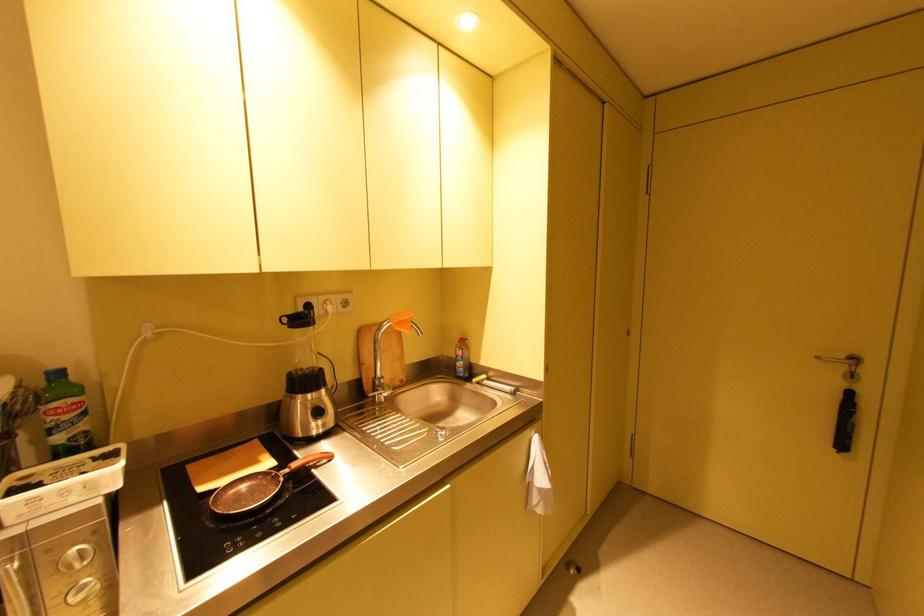
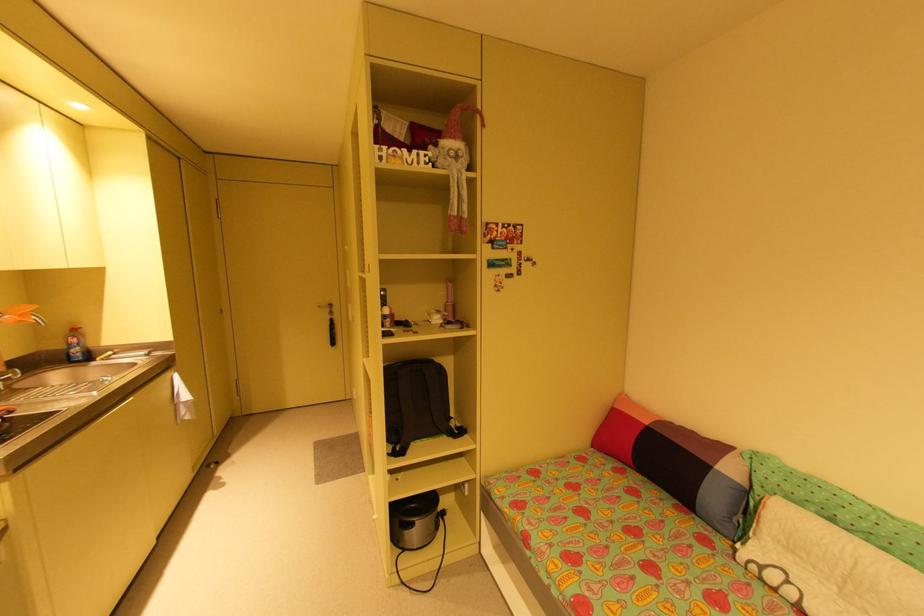
Find the pixel in the second image that matches [848,369] in the first image.

(333, 310)